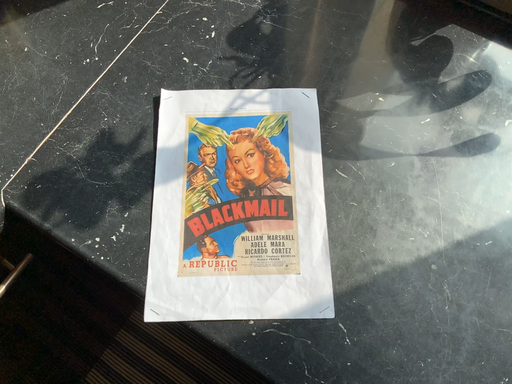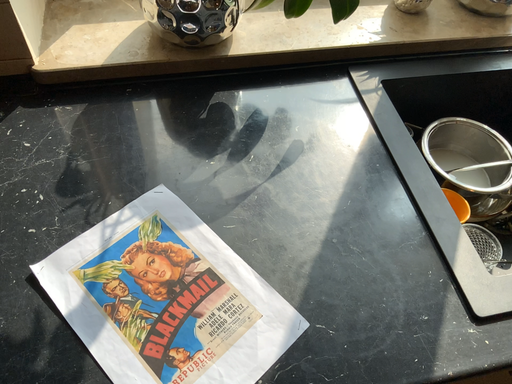
Question: Which way did the camera rotate in the video?

Choices:
 (A) rotated right
 (B) rotated left

Answer: (A)